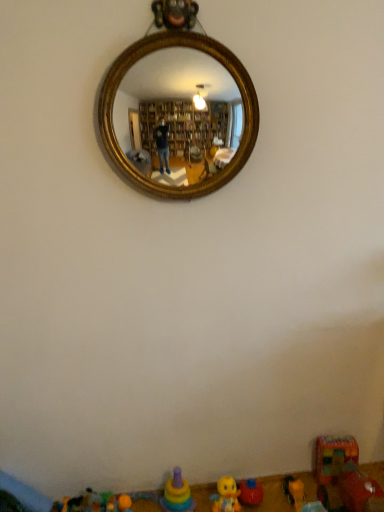
Question: In terms of width, does multicolored plastic stacking rings at lower center, acting as the 3th toy starting from the left, look wider or thinner when compared to orange rubber ball at lower center, the 6th toy in the right-to-left sequence?

Choices:
 (A) wide
 (B) thin

Answer: (A)

Question: Is multicolored plastic stacking rings at lower center, acting as the 3th toy starting from the left, bigger or smaller than orange rubber ball at lower center, the 6th toy in the right-to-left sequence?

Choices:
 (A) big
 (B) small

Answer: (A)

Question: Estimate the real-world distances between objects in this image. Which object is farther from the yellow plastic toy at lower right, which is the 6th toy from left to right?

Choices:
 (A) plastic multicolored car at lower right, which is the first toy from right to left
 (B) gold/gilded mirror at upper center
 (C) yellow rubber duck at lower center, which is the fourth toy in right-to-left order
 (D) multicolored plastic stacking rings at lower center, acting as the 5th toy starting from the right
 (E) rubber duck at lower center, which is the third toy from right to left

Answer: (B)

Question: Which object is the farthest from the yellow rubber duck at lower center, which is the fourth toy in right-to-left order?

Choices:
 (A) plastic multicolored car at lower right, which is the first toy from right to left
 (B) multicolored plastic stacking rings at lower center, acting as the 5th toy starting from the right
 (C) yellow plastic toy at lower right, which is the 6th toy from left to right
 (D) gold/gilded mirror at upper center
 (E) rubber duck at lower center, the seventh toy from the right

Answer: (D)